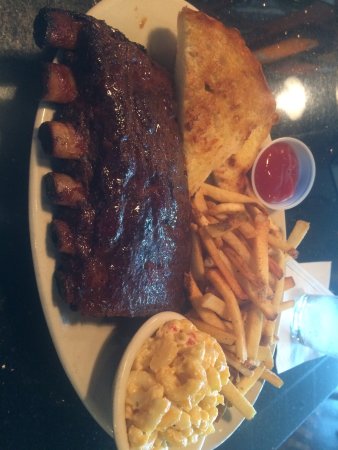
The height and width of the screenshot is (450, 338). What are the coordinates of `table top` in the screenshot? It's located at (268, 404).